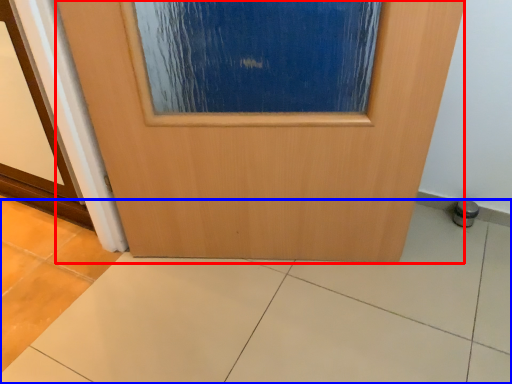
Question: Among these objects, which one is nearest to the camera, door (highlighted by a red box) or ceramic tile (highlighted by a blue box)?

Choices:
 (A) door
 (B) ceramic tile

Answer: (B)